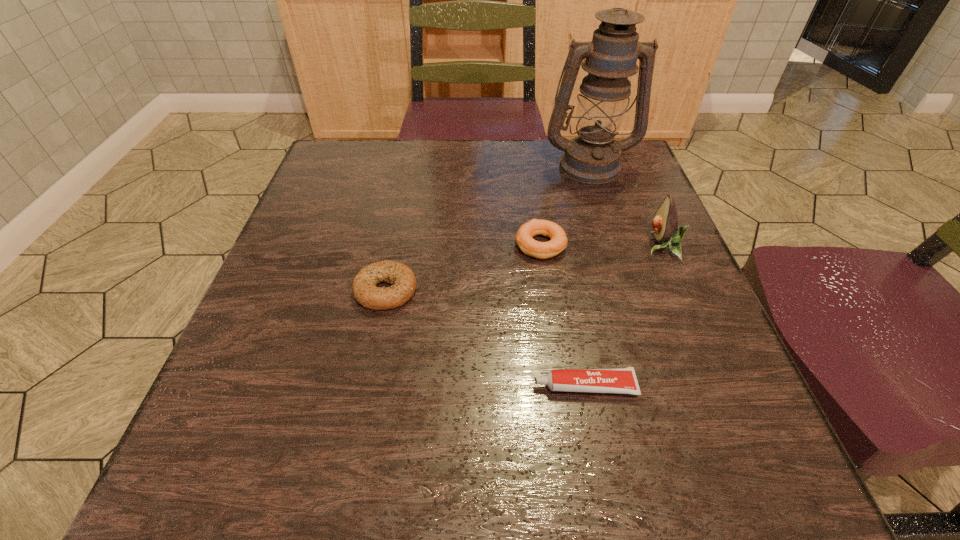
Where is `the farthest object`? the farthest object is located at coordinates (592, 157).

At what (x,y) coordinates should I click in order to perform the action: click on oil lamp. Please return your answer as a coordinate pair (x, y). The width and height of the screenshot is (960, 540). Looking at the image, I should click on (592, 157).

This screenshot has height=540, width=960. In order to click on avocado in this screenshot , I will do `click(665, 222)`.

Where is `the fourth farthest object`? the fourth farthest object is located at coordinates (402, 278).

Where is `the left bagel`? the left bagel is located at coordinates (402, 278).

Where is `the right bagel`? The width and height of the screenshot is (960, 540). the right bagel is located at coordinates (524, 237).

This screenshot has height=540, width=960. In order to click on toothpaste in this screenshot , I will do `click(623, 380)`.

The image size is (960, 540). Find the location of `the shortest object`. the shortest object is located at coordinates (623, 380).

The height and width of the screenshot is (540, 960). I want to click on vacant space located 0.370m on the front of the tallest object, so click(x=634, y=307).

Locate an element on the screen. This screenshot has width=960, height=540. vacant space positioned on the seed side of the avocado is located at coordinates (471, 246).